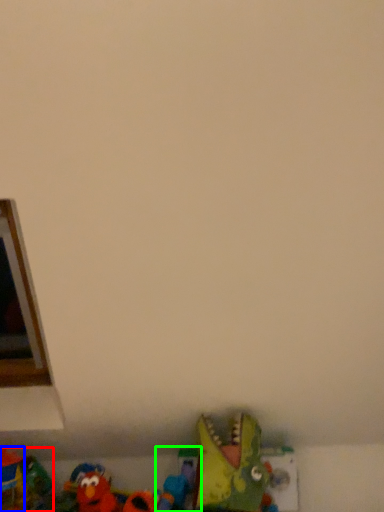
Question: Estimate the real-world distances between objects in this image. Which object is farther from toy (highlighted by a red box), toy (highlighted by a blue box) or toy (highlighted by a green box)?

Choices:
 (A) toy
 (B) toy

Answer: (B)